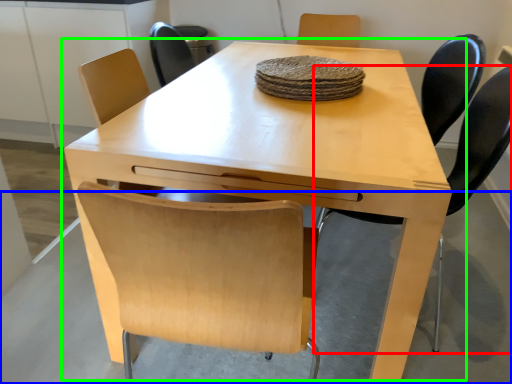
Question: Which object is the farthest from chair (highlighted by a red box)? Choose among these: concrete (highlighted by a blue box) or table (highlighted by a green box).

Choices:
 (A) concrete
 (B) table

Answer: (A)